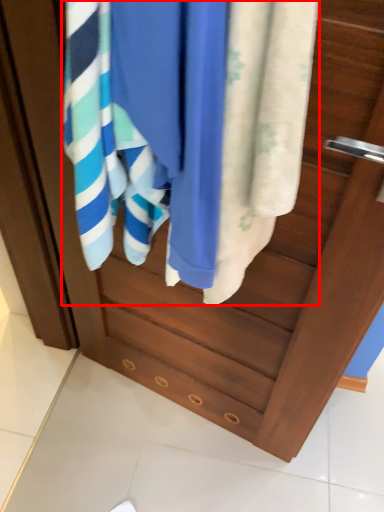
Question: From the image's perspective, what is the correct spatial relationship of bath towel (annotated by the red box) in relation to towel?

Choices:
 (A) above
 (B) below

Answer: (A)